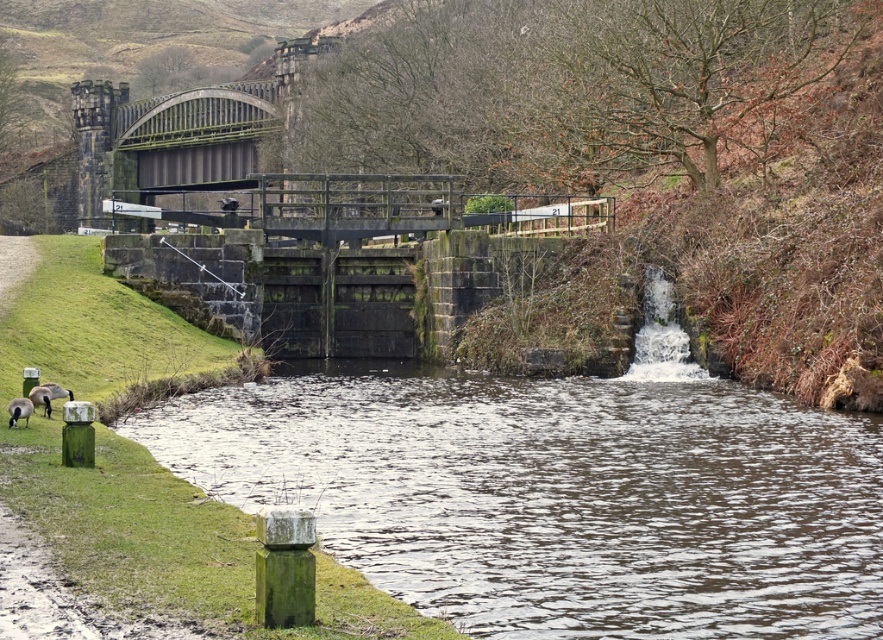
Is point (731, 436) positioned behind point (17, 401)?

Yes, it is behind point (17, 401).

Is brown/rough stone river at center taller than brown fuzzy duck at lower left?

Correct, brown/rough stone river at center is much taller as brown fuzzy duck at lower left.

Is point (553, 552) positioned in front of point (13, 403)?

Yes, it is.

Image resolution: width=883 pixels, height=640 pixels. Identify the location of brown/rough stone river at center. (557, 493).